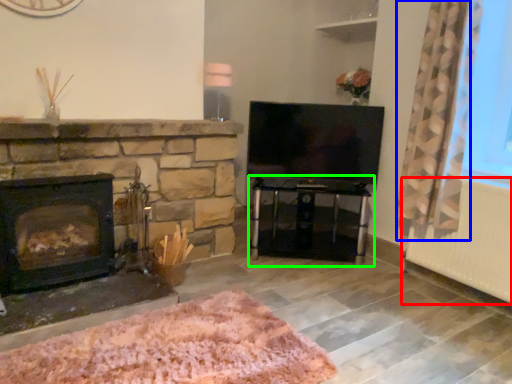
Question: Which object is the farthest from radiator (highlighted by a red box)? Choose among these: curtain (highlighted by a blue box) or table (highlighted by a green box).

Choices:
 (A) curtain
 (B) table

Answer: (B)